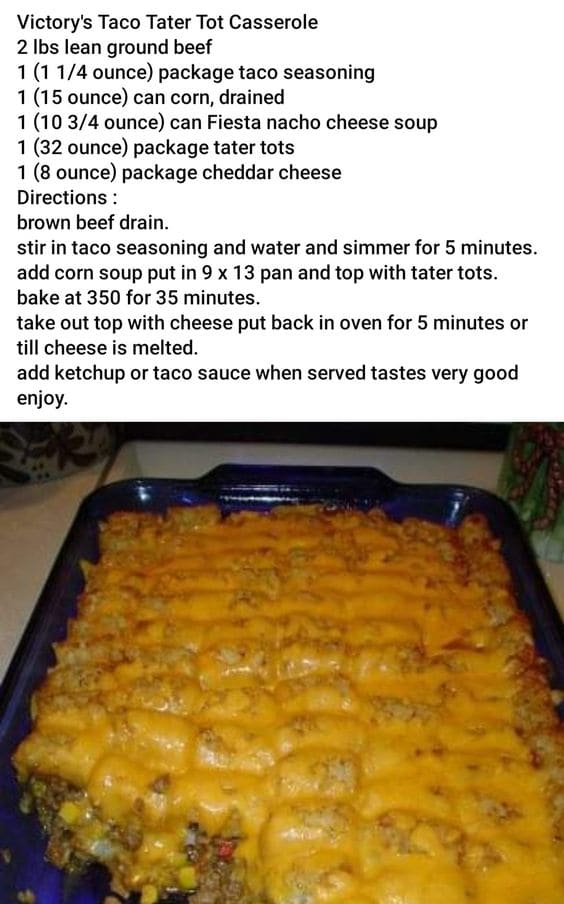
The image size is (564, 904). I want to click on ceramic cannister or pot lft, so click(45, 460).